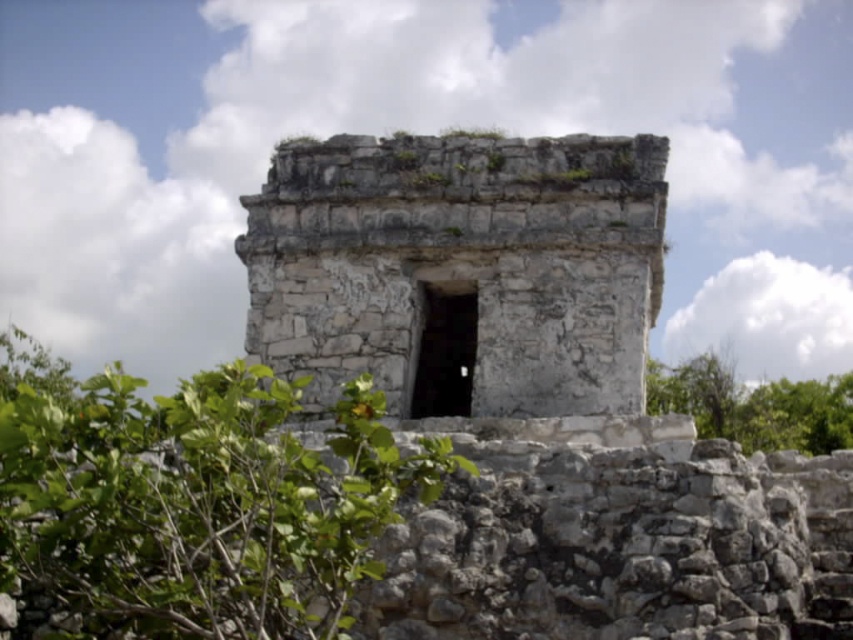
Question: Does white stone ruins at center appear under green leafy bush at center?

Choices:
 (A) no
 (B) yes

Answer: (A)

Question: Which object is the closest to the green leafy tree at lower right?

Choices:
 (A) white stone ruins at center
 (B) green leafy bush at center

Answer: (A)

Question: Which point is closer to the camera?

Choices:
 (A) (392, 390)
 (B) (709, 385)
 (C) (294, 563)

Answer: (C)

Question: Does white stone ruins at center have a larger size compared to green leafy tree at lower right?

Choices:
 (A) yes
 (B) no

Answer: (B)

Question: Which of the following is the farthest from the observer?

Choices:
 (A) (775, 404)
 (B) (288, 150)
 (C) (202, 408)

Answer: (A)

Question: Is green leafy bush at center positioned behind green leafy tree at lower right?

Choices:
 (A) no
 (B) yes

Answer: (A)